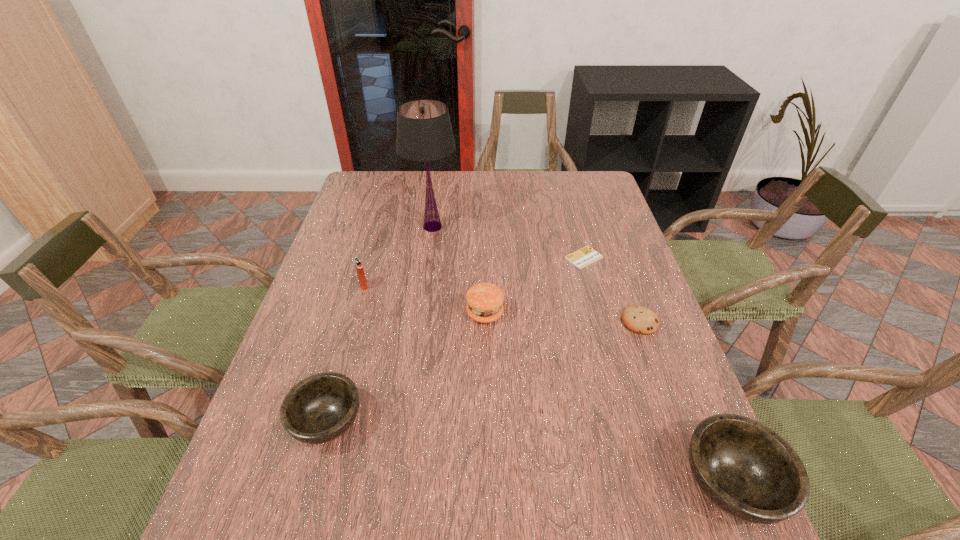
At what (x,y) coordinates should I click in order to perform the action: click on vacant space that satisfies the following two spatial constraints: 1. on the front-facing side of the tallest object; 2. on the right side of the taller bowl. Please return your answer as a coordinate pair (x, y). This screenshot has height=540, width=960. Looking at the image, I should click on (397, 484).

Where is `vacant area in the image that satisfies the following two spatial constraints: 1. on the front-facing side of the third object from left to right; 2. on the left side of the second shortest object`? The width and height of the screenshot is (960, 540). vacant area in the image that satisfies the following two spatial constraints: 1. on the front-facing side of the third object from left to right; 2. on the left side of the second shortest object is located at coordinates (420, 321).

Identify the location of vacant space that satisfies the following two spatial constraints: 1. on the front-facing side of the right bowl; 2. on the left side of the tallest object. The image size is (960, 540). (397, 484).